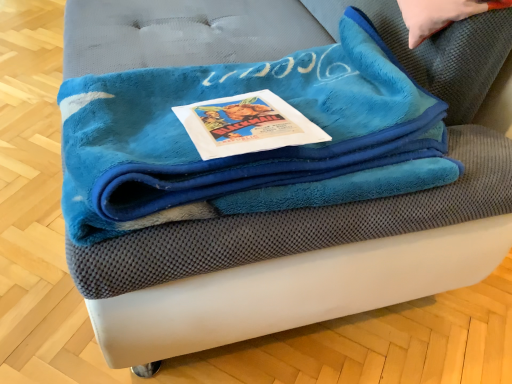
Identify the location of blue plush towel at center. (298, 225).

This screenshot has width=512, height=384. What do you see at coordinates (298, 225) in the screenshot?
I see `blue plush towel at center` at bounding box center [298, 225].

The height and width of the screenshot is (384, 512). Find the location of `blue plush towel at center`. blue plush towel at center is located at coordinates (298, 225).